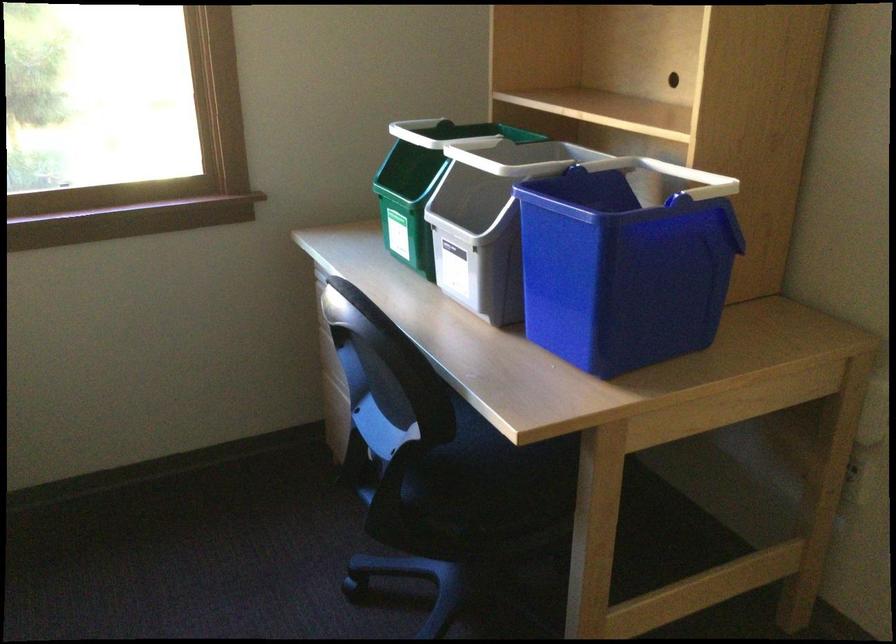
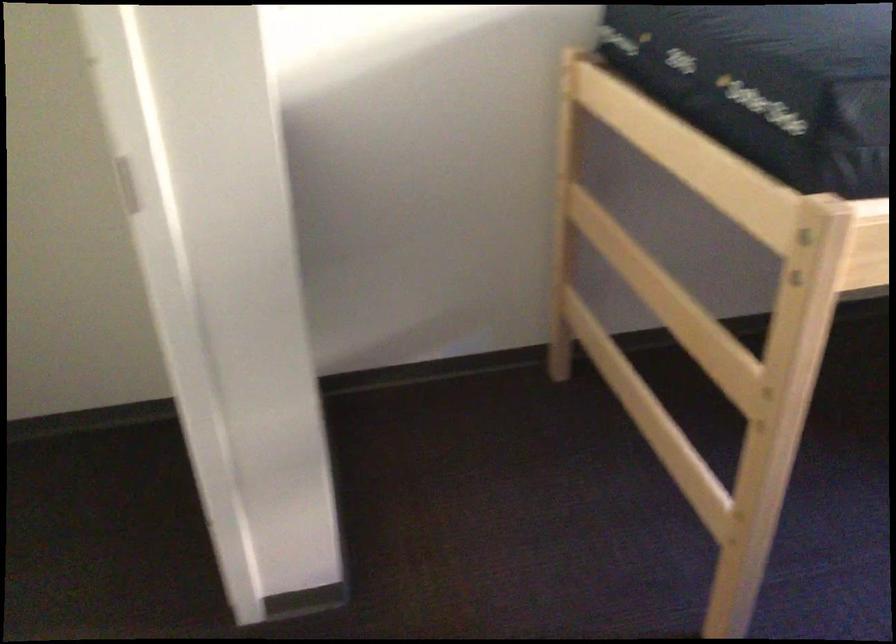
Based on the continuous images, in which direction is the camera rotating?

The rotation direction of the camera is left-down.